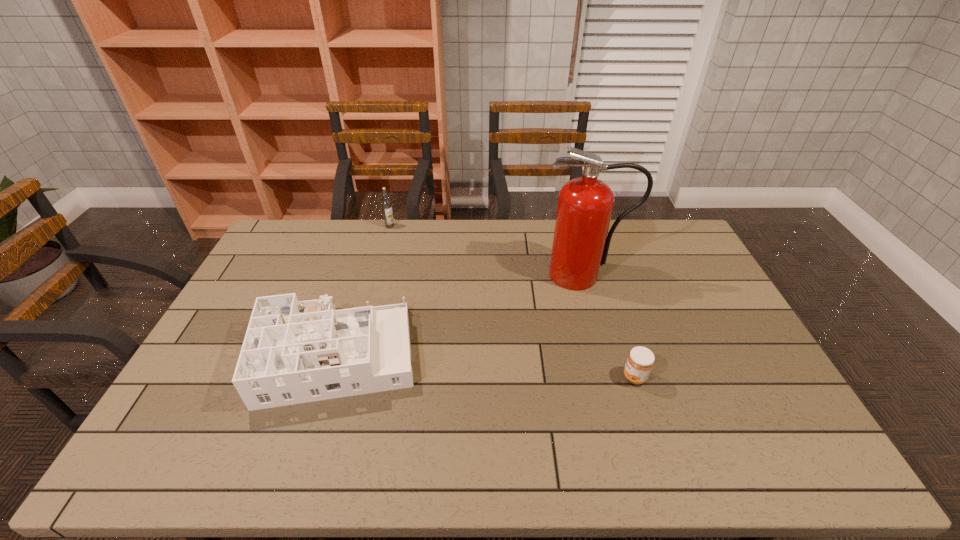
At what (x,y) coordinates should I click in order to perform the action: click on object that ranks as the second closest to the tallest object. Please return your answer as a coordinate pair (x, y). Looking at the image, I should click on (294, 352).